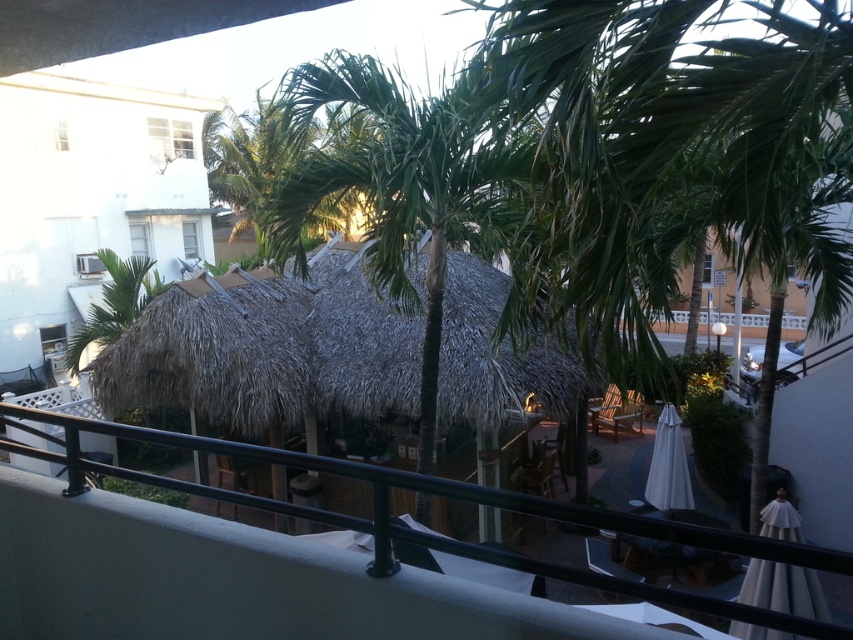
Question: Is the position of thatched straw hut at center more distant than that of black metal/rail at lower center?

Choices:
 (A) yes
 (B) no

Answer: (A)

Question: Does green leafy palm tree at center appear on the left side of black metal/rail at lower center?

Choices:
 (A) no
 (B) yes

Answer: (A)

Question: Considering the real-world distances, which object is closest to the black metal/rail at lower center?

Choices:
 (A) green leafy palm tree at center
 (B) thatched straw hut at center

Answer: (A)

Question: Which object is closer to the camera taking this photo?

Choices:
 (A) thatched straw hut at center
 (B) green leafy palm tree at center
 (C) black metal/rail at lower center

Answer: (C)

Question: Which point is closer to the camera?

Choices:
 (A) green leafy palm tree at center
 (B) black metal/rail at lower center

Answer: (B)

Question: Is green leafy palm tree at center above black metal/rail at lower center?

Choices:
 (A) yes
 (B) no

Answer: (A)